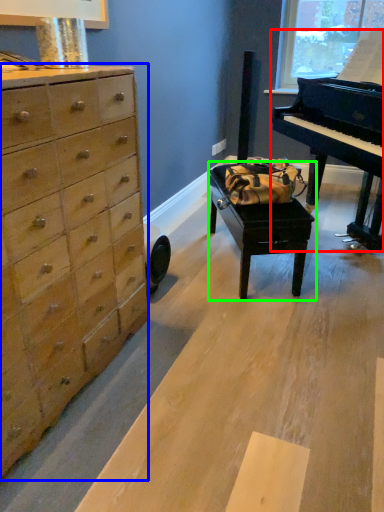
Question: Which object is positioned farthest from piano (highlighted by a red box)? Select from chest of drawers (highlighted by a blue box) and table (highlighted by a green box).

Choices:
 (A) chest of drawers
 (B) table

Answer: (A)